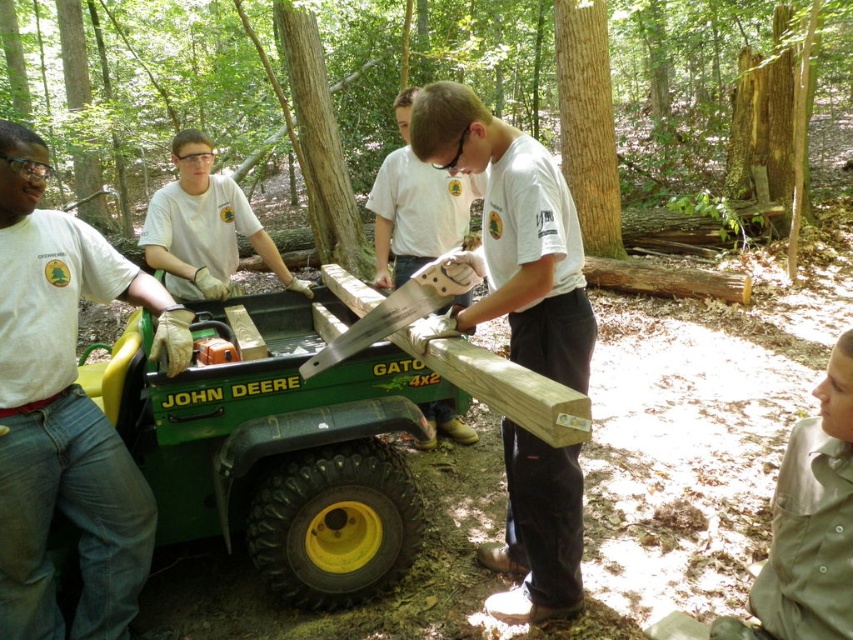
Question: Is natural wood log at center behind matte white saw at center?

Choices:
 (A) yes
 (B) no

Answer: (A)

Question: Observing the image, what is the correct spatial positioning of natural wood log at center in reference to light brown wood at center?

Choices:
 (A) above
 (B) below

Answer: (A)

Question: Which of these objects is positioned closest to the denim jeans at left?

Choices:
 (A) natural wood log at center
 (B) matte white saw at center
 (C) white matte shirt at upper center

Answer: (C)

Question: Which object is the farthest from the white matte shirt at upper center?

Choices:
 (A) light brown wood at center
 (B) natural wood log at center
 (C) denim jeans at left
 (D) matte white saw at center

Answer: (B)

Question: Considering the relative positions of light brown wood at center and white matte shirt at upper center in the image provided, where is light brown wood at center located with respect to white matte shirt at upper center?

Choices:
 (A) below
 (B) above

Answer: (A)

Question: Which point is farther to the camera?

Choices:
 (A) matte white saw at center
 (B) natural wood log at center
 (C) denim jeans at left
 (D) metallic saw at center

Answer: (B)